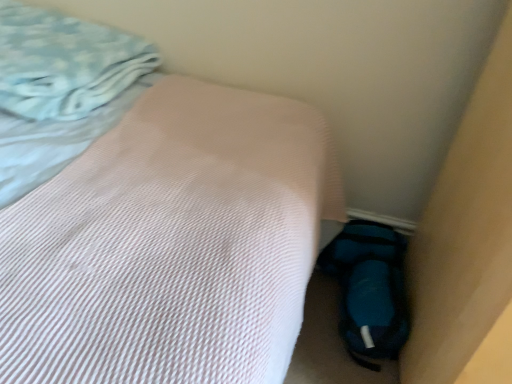
Question: Can you confirm if pink textured bed at center is wider than light blue textured blanket at upper left?

Choices:
 (A) yes
 (B) no

Answer: (A)

Question: Is there a large distance between pink textured bed at center and light blue textured blanket at upper left?

Choices:
 (A) yes
 (B) no

Answer: (B)

Question: Is pink textured bed at center touching light blue textured blanket at upper left?

Choices:
 (A) no
 (B) yes

Answer: (A)

Question: Is light blue textured blanket at upper left a part of pink textured bed at center?

Choices:
 (A) yes
 (B) no

Answer: (A)

Question: Can you confirm if pink textured bed at center is positioned to the right of light blue textured blanket at upper left?

Choices:
 (A) no
 (B) yes

Answer: (B)

Question: Is light blue textured blanket at upper left bigger or smaller than pink textured bed at center?

Choices:
 (A) small
 (B) big

Answer: (A)

Question: In the image, is light blue textured blanket at upper left positioned in front of or behind pink textured bed at center?

Choices:
 (A) behind
 (B) front

Answer: (A)

Question: From a real-world perspective, relative to pink textured bed at center, is light blue textured blanket at upper left vertically above or below?

Choices:
 (A) below
 (B) above

Answer: (B)

Question: Is light blue textured blanket at upper left wider or thinner than pink textured bed at center?

Choices:
 (A) thin
 (B) wide

Answer: (A)

Question: Is blue fuzzy sleeping bag at lower right spatially inside light blue textured blanket at upper left, or outside of it?

Choices:
 (A) outside
 (B) inside

Answer: (A)

Question: Is blue fuzzy sleeping bag at lower right taller or shorter than light blue textured blanket at upper left?

Choices:
 (A) tall
 (B) short

Answer: (B)

Question: From the image's perspective, is blue fuzzy sleeping bag at lower right positioned above or below light blue textured blanket at upper left?

Choices:
 (A) below
 (B) above

Answer: (A)

Question: Would you say blue fuzzy sleeping bag at lower right is to the left or to the right of light blue textured blanket at upper left in the picture?

Choices:
 (A) right
 (B) left

Answer: (A)

Question: In terms of height, does pink textured bed at center look taller or shorter compared to blue fuzzy sleeping bag at lower right?

Choices:
 (A) tall
 (B) short

Answer: (A)

Question: From a real-world perspective, relative to blue fuzzy sleeping bag at lower right, is pink textured bed at center vertically above or below?

Choices:
 (A) below
 (B) above

Answer: (B)